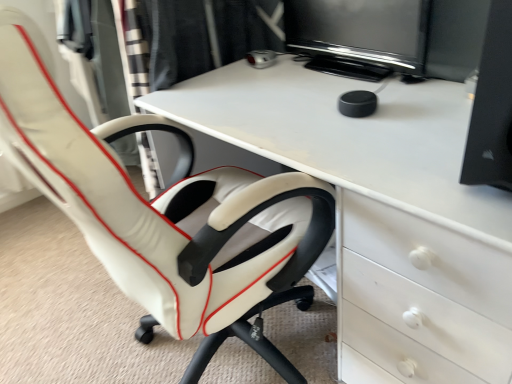
Where is `free space in front of black glossy monitor at upper center`? This screenshot has height=384, width=512. free space in front of black glossy monitor at upper center is located at coordinates (359, 91).